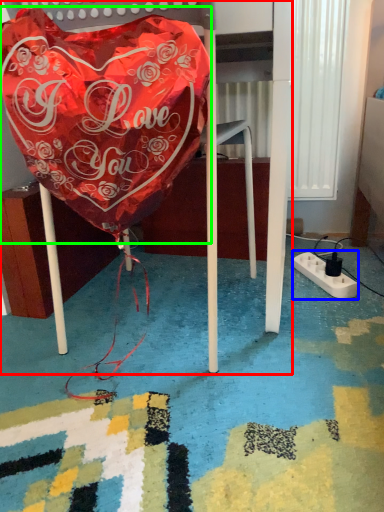
Question: Which object is the farthest from furniture (highlighted by a red box)? Choose among these: extension cord (highlighted by a blue box) or blanket (highlighted by a green box).

Choices:
 (A) extension cord
 (B) blanket

Answer: (A)